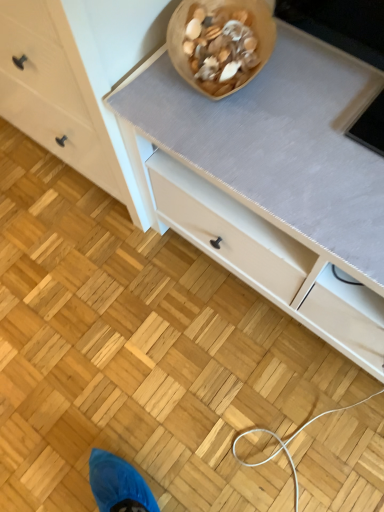
Question: Considering the positions of wooden bowl at upper center and white matte chest of drawers at lower left in the image, is wooden bowl at upper center bigger or smaller than white matte chest of drawers at lower left?

Choices:
 (A) small
 (B) big

Answer: (A)

Question: Does point (203, 51) appear closer or farther from the camera than point (54, 99)?

Choices:
 (A) closer
 (B) farther

Answer: (A)

Question: In terms of height, does wooden bowl at upper center look taller or shorter compared to white matte chest of drawers at lower left?

Choices:
 (A) tall
 (B) short

Answer: (B)

Question: From the image's perspective, is white matte chest of drawers at lower left located above or below wooden bowl at upper center?

Choices:
 (A) below
 (B) above

Answer: (B)

Question: In the image, is white matte chest of drawers at lower left on the left side or the right side of wooden bowl at upper center?

Choices:
 (A) left
 (B) right

Answer: (A)

Question: Is white matte chest of drawers at lower left spatially inside wooden bowl at upper center, or outside of it?

Choices:
 (A) inside
 (B) outside

Answer: (B)

Question: Is white matte chest of drawers at lower left bigger or smaller than wooden bowl at upper center?

Choices:
 (A) small
 (B) big

Answer: (B)